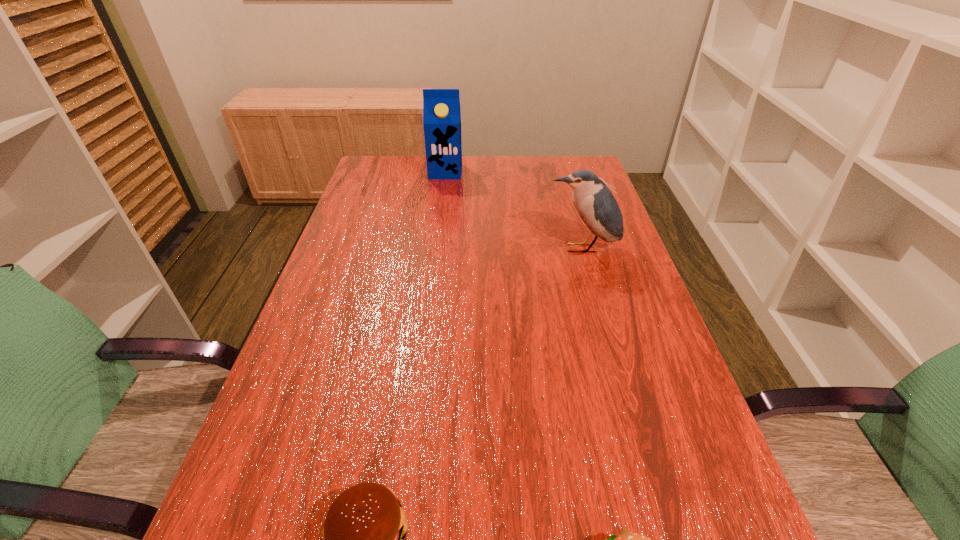
Find the location of a particular element. The width and height of the screenshot is (960, 540). carton is located at coordinates (441, 107).

Locate an element on the screen. This screenshot has height=540, width=960. the tallest object is located at coordinates tap(441, 107).

Where is `bird`? bird is located at coordinates (596, 205).

Where is `the second farthest object`? Image resolution: width=960 pixels, height=540 pixels. the second farthest object is located at coordinates (596, 205).

I want to click on free space located 0.150m with the cap open on the farthest object, so click(x=442, y=204).

Find the location of a particular element. The height and width of the screenshot is (540, 960). free space located at the tip of the bird's beak is located at coordinates (611, 347).

You are a GUI agent. You are given a task and a screenshot of the screen. Output one action in this format:
    pyautogui.click(x=<x>, y=<y>)
    Task: Click on the object that is at the far edge
    The height and width of the screenshot is (540, 960).
    Given the screenshot: What is the action you would take?
    pyautogui.click(x=441, y=107)

You are a GUI agent. You are given a task and a screenshot of the screen. Output one action in this format:
    pyautogui.click(x=<x>, y=<y>)
    Task: Click on the object that is positioned at the right edge
    
    Given the screenshot: What is the action you would take?
    pyautogui.click(x=596, y=205)

You are a GUI agent. You are given a task and a screenshot of the screen. Output one action in this format:
    pyautogui.click(x=<x>, y=<y>)
    Task: Click on the free spot at the far edge of the desktop
    Image resolution: width=960 pixels, height=540 pixels.
    Given the screenshot: What is the action you would take?
    pyautogui.click(x=515, y=160)

In the image, there is a desktop. Where is `vacant space at the left edge`? The image size is (960, 540). vacant space at the left edge is located at coordinates (395, 217).